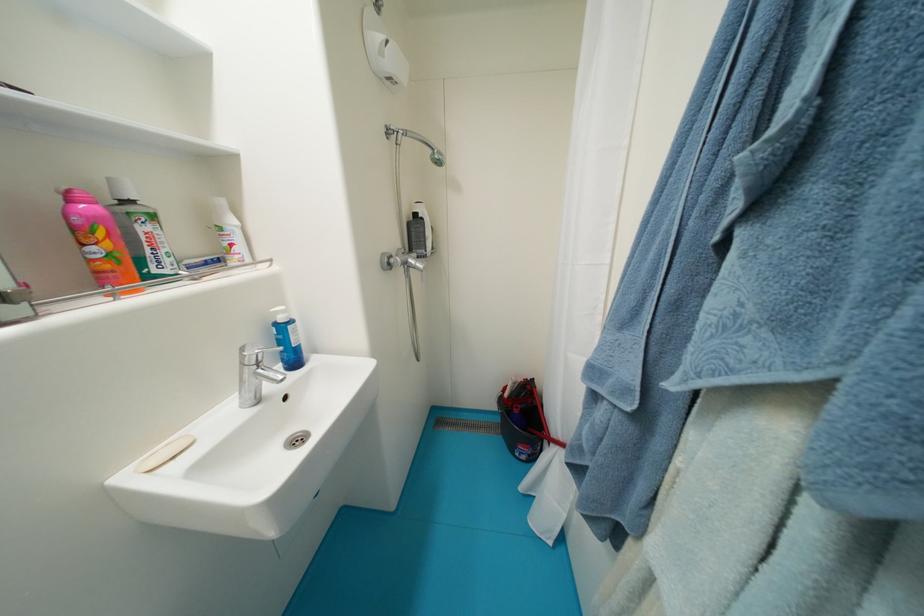
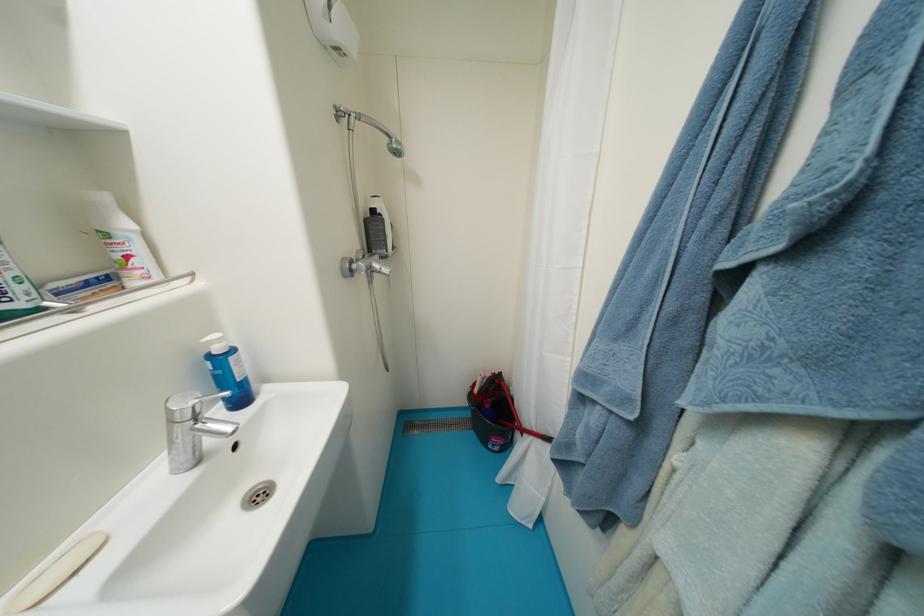
In the second image, find the point that corresponds to pixel 421 217 in the first image.

(380, 214)